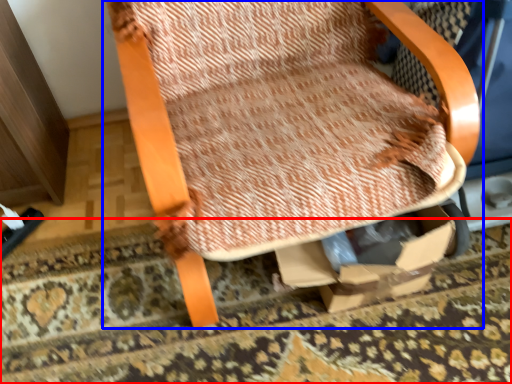
Question: Which object is closer to the camera taking this photo, mat (highlighted by a red box) or chair (highlighted by a blue box)?

Choices:
 (A) mat
 (B) chair

Answer: (B)